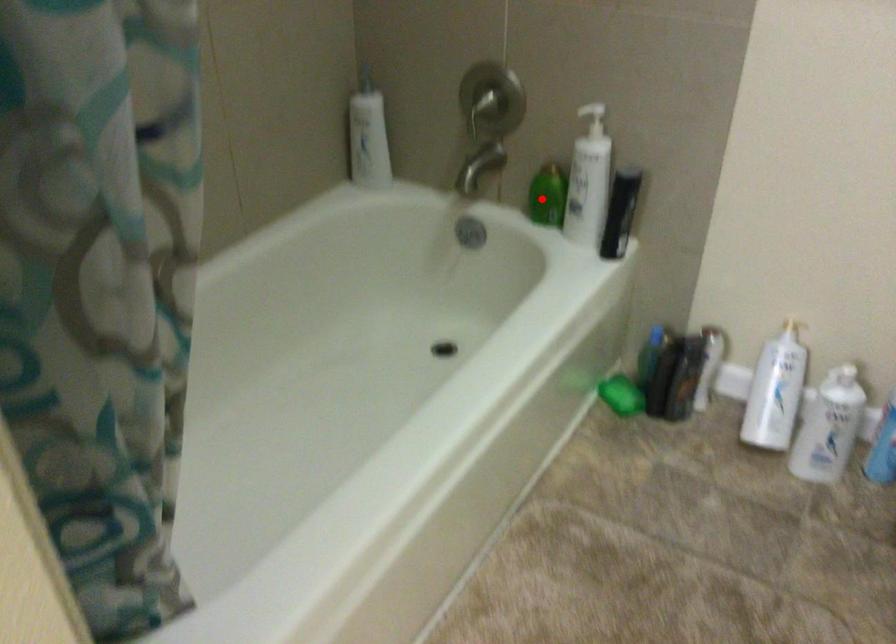
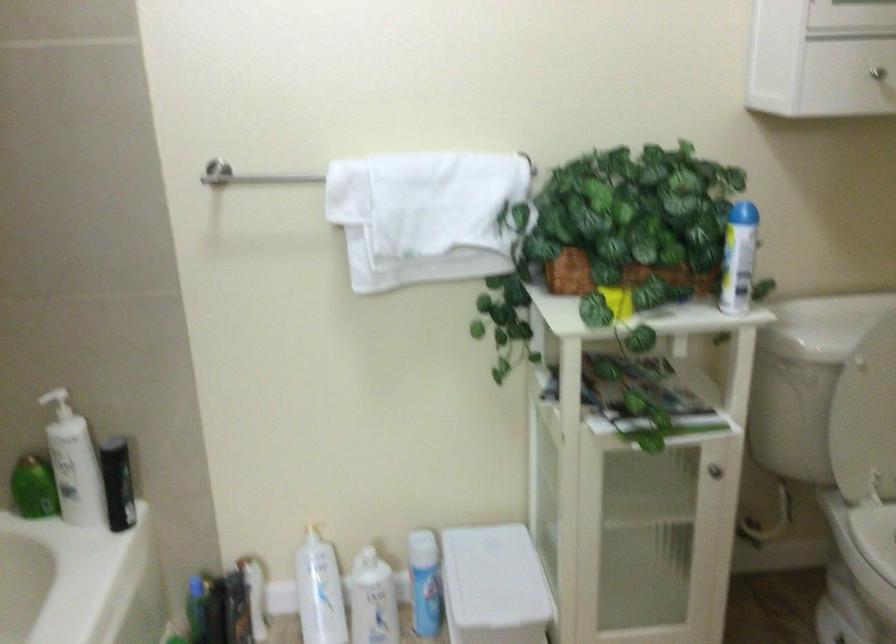
Locate, in the second image, the point that corresponds to the highlighted location in the first image.

(33, 488)